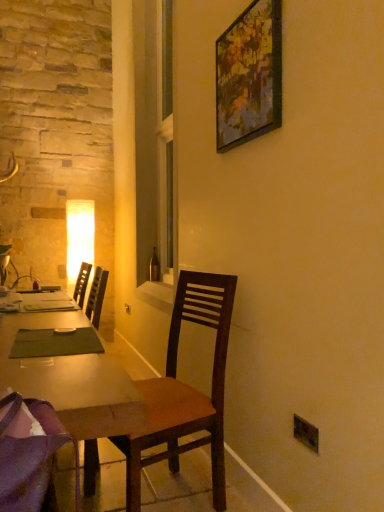
Question: Is wooden desk at center smaller than purple fabric chair at lower left, which ranks as the 2th chair in back-to-front order?

Choices:
 (A) yes
 (B) no

Answer: (B)

Question: Is wooden desk at center to the left of purple fabric chair at lower left, which is the first chair from front to back, from the viewer's perspective?

Choices:
 (A) yes
 (B) no

Answer: (A)

Question: Can you confirm if wooden desk at center is wider than purple fabric chair at lower left, which ranks as the 2th chair in back-to-front order?

Choices:
 (A) yes
 (B) no

Answer: (A)

Question: From the image's perspective, is wooden desk at center located beneath purple fabric chair at lower left, which is the first chair from front to back?

Choices:
 (A) no
 (B) yes

Answer: (B)

Question: Would you say purple fabric chair at lower left, which is the first chair from front to back, is part of wooden desk at center's contents?

Choices:
 (A) yes
 (B) no

Answer: (B)

Question: Would you say wooden desk at center is a long distance from purple fabric chair at lower left, which ranks as the 2th chair in back-to-front order?

Choices:
 (A) yes
 (B) no

Answer: (B)

Question: From the image's perspective, is brown glass bottle at center above black plastic power outlet at lower right?

Choices:
 (A) yes
 (B) no

Answer: (A)

Question: Does brown glass bottle at center come in front of black plastic power outlet at lower right?

Choices:
 (A) no
 (B) yes

Answer: (B)

Question: Considering the relative sizes of brown glass bottle at center and black plastic power outlet at lower right in the image provided, is brown glass bottle at center taller than black plastic power outlet at lower right?

Choices:
 (A) no
 (B) yes

Answer: (B)

Question: Does brown glass bottle at center appear on the left side of black plastic power outlet at lower right?

Choices:
 (A) yes
 (B) no

Answer: (B)

Question: Does brown glass bottle at center come behind black plastic power outlet at lower right?

Choices:
 (A) no
 (B) yes

Answer: (A)

Question: Can you confirm if brown glass bottle at center is positioned to the right of black plastic power outlet at lower right?

Choices:
 (A) no
 (B) yes

Answer: (B)

Question: From the image's perspective, is brown glass bottle at center beneath wooden desk at center?

Choices:
 (A) yes
 (B) no

Answer: (B)